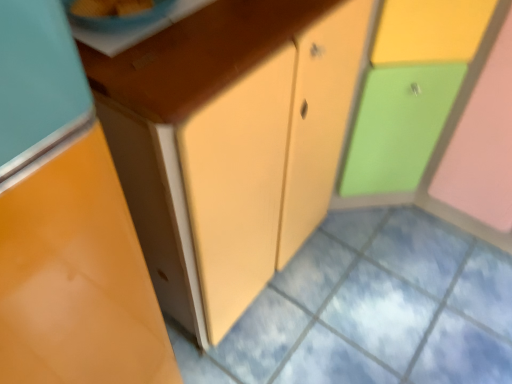
Question: From a real-world perspective, is matte orange cabinet at left, marked as the 2th cabinetry in a right-to-left arrangement, below matte yellow cabinet at center?

Choices:
 (A) yes
 (B) no

Answer: (B)

Question: Does matte orange cabinet at left, marked as the 2th cabinetry in a right-to-left arrangement, have a greater width compared to matte yellow cabinet at center?

Choices:
 (A) yes
 (B) no

Answer: (B)

Question: Does matte orange cabinet at left, the first cabinetry viewed from the left, have a greater height compared to matte yellow cabinet at center?

Choices:
 (A) yes
 (B) no

Answer: (A)

Question: From a real-world perspective, is matte orange cabinet at left, marked as the 2th cabinetry in a right-to-left arrangement, on top of matte yellow cabinet at center?

Choices:
 (A) yes
 (B) no

Answer: (A)

Question: Considering the relative sizes of matte orange cabinet at left, the first cabinetry viewed from the left, and matte yellow cabinet at center in the image provided, is matte orange cabinet at left, the first cabinetry viewed from the left, shorter than matte yellow cabinet at center?

Choices:
 (A) no
 (B) yes

Answer: (A)

Question: From the image's perspective, relative to blue glossy bowl at upper left, is matte orange cabinet at left, marked as the 2th cabinetry in a right-to-left arrangement, above or below?

Choices:
 (A) above
 (B) below

Answer: (B)

Question: In terms of size, does matte orange cabinet at left, the first cabinetry viewed from the left, appear bigger or smaller than blue glossy bowl at upper left?

Choices:
 (A) big
 (B) small

Answer: (A)

Question: Is matte orange cabinet at left, marked as the 2th cabinetry in a right-to-left arrangement, situated inside blue glossy bowl at upper left or outside?

Choices:
 (A) outside
 (B) inside

Answer: (A)

Question: In terms of height, does matte orange cabinet at left, the first cabinetry viewed from the left, look taller or shorter compared to blue glossy bowl at upper left?

Choices:
 (A) tall
 (B) short

Answer: (A)

Question: Is matte yellow cabinet at center in front of or behind blue glossy bowl at upper left in the image?

Choices:
 (A) behind
 (B) front

Answer: (A)

Question: Considering the positions of point (379, 249) and point (130, 14), is point (379, 249) closer or farther from the camera than point (130, 14)?

Choices:
 (A) closer
 (B) farther

Answer: (B)

Question: Considering the positions of matte yellow cabinet at center and blue glossy bowl at upper left in the image, is matte yellow cabinet at center taller or shorter than blue glossy bowl at upper left?

Choices:
 (A) tall
 (B) short

Answer: (A)

Question: Is matte yellow cabinet at center wider or thinner than blue glossy bowl at upper left?

Choices:
 (A) wide
 (B) thin

Answer: (A)

Question: In terms of height, does matte plastic cabinet at right, which is the 2th cabinetry in left-to-right order, look taller or shorter compared to matte yellow cabinet at center?

Choices:
 (A) tall
 (B) short

Answer: (A)

Question: Is matte plastic cabinet at right, which is the 2th cabinetry in left-to-right order, inside the boundaries of matte yellow cabinet at center, or outside?

Choices:
 (A) outside
 (B) inside

Answer: (A)